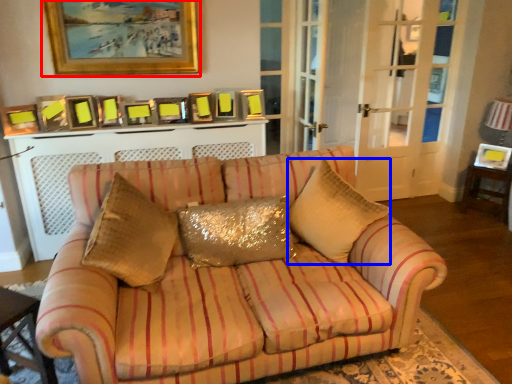
Question: Which of the following is the farthest to the observer, picture frame (highlighted by a red box) or throw pillow (highlighted by a blue box)?

Choices:
 (A) picture frame
 (B) throw pillow

Answer: (A)